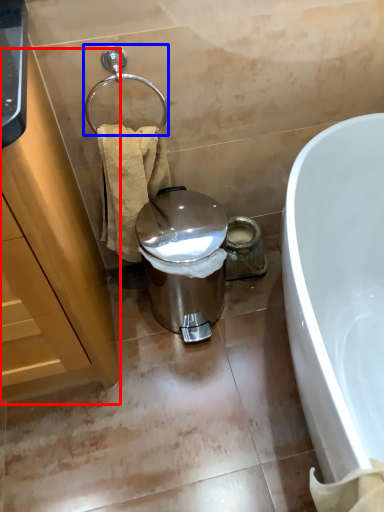
Question: Which of the following is the farthest to the observer, cabinetry (highlighted by a red box) or shower (highlighted by a blue box)?

Choices:
 (A) cabinetry
 (B) shower

Answer: (B)